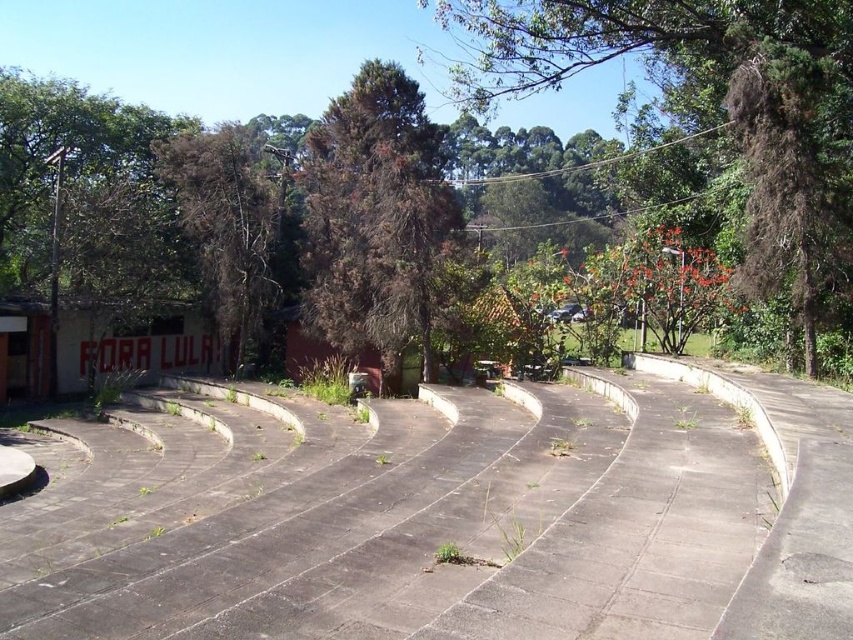
Does brown/dry leaves at left have a greater width compared to red painted concrete amphitheater at lower left?

Yes.

Is brown/dry leaves at left shorter than red painted concrete amphitheater at lower left?

Incorrect, brown/dry leaves at left's height does not fall short of red painted concrete amphitheater at lower left's.

Who is more forward, (248, 298) or (113, 349)?

Positioned in front is point (248, 298).

You are a GUI agent. You are given a task and a screenshot of the screen. Output one action in this format:
    pyautogui.click(x=<x>, y=<y>)
    Task: Click on the brown/dry leaves at left
    This screenshot has width=853, height=640.
    Given the screenshot: What is the action you would take?
    pyautogui.click(x=228, y=224)

Between brown/dry leaves tree at center and brown/dry leaves at left, which one is positioned higher?

brown/dry leaves tree at center is above.

Which is in front, point (409, 198) or point (223, 326)?

Point (409, 198) is in front.

Is point (370, 120) positioned after point (242, 310)?

No, it is not.

You are a GUI agent. You are given a task and a screenshot of the screen. Output one action in this format:
    pyautogui.click(x=<x>, y=<y>)
    Task: Click on the brown/dry leaves tree at center
    
    Given the screenshot: What is the action you would take?
    pyautogui.click(x=376, y=220)

Who is higher up, brown/dry leaves tree at center or red painted concrete amphitheater at lower left?

brown/dry leaves tree at center is above.

Does point (451, 221) lie in front of point (9, 365)?

Yes, point (451, 221) is closer to viewer.

At what (x,y) coordinates should I click in order to perform the action: click on brown/dry leaves tree at center. Please return your answer as a coordinate pair (x, y). The width and height of the screenshot is (853, 640). Looking at the image, I should click on (376, 220).